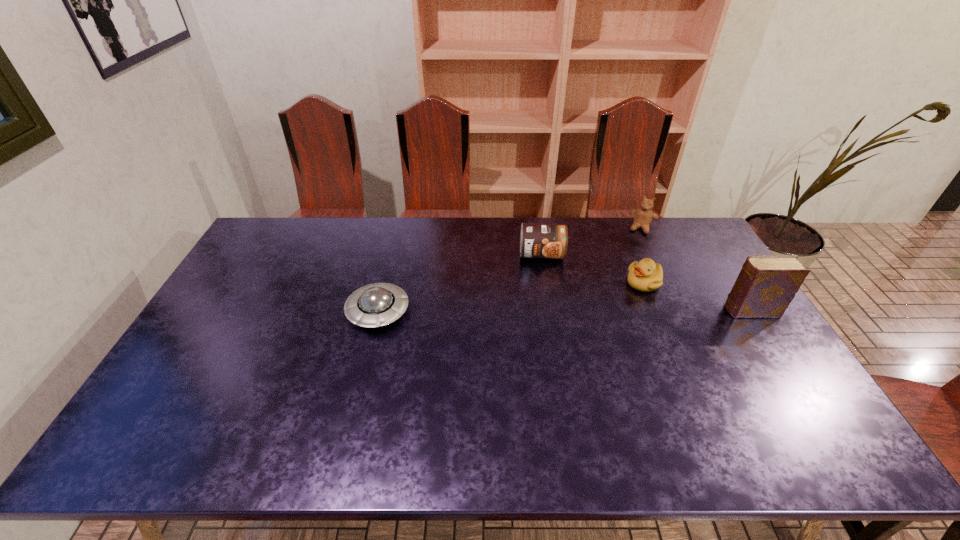
Where is `saucer`? The height and width of the screenshot is (540, 960). saucer is located at coordinates (378, 304).

The width and height of the screenshot is (960, 540). In order to click on the leftmost object in this screenshot , I will do `click(378, 304)`.

The width and height of the screenshot is (960, 540). I want to click on diary, so click(766, 285).

I want to click on the tallest object, so point(766,285).

At what (x,y) coordinates should I click in order to perform the action: click on duckling. Please return your answer as a coordinate pair (x, y). Looking at the image, I should click on (645, 275).

Identify the location of the fourth object from right to left. (537, 240).

At what (x,y) coordinates should I click in order to perform the action: click on can. Please return your answer as a coordinate pair (x, y). This screenshot has height=540, width=960. Looking at the image, I should click on (537, 240).

Locate an element on the screen. The width and height of the screenshot is (960, 540). teddy bear is located at coordinates click(x=643, y=216).

Identify the location of blank space located on the back of the saucer. (398, 230).

Image resolution: width=960 pixels, height=540 pixels. In order to click on vacant point located 0.120m on the spine side of the diary in this screenshot , I will do `click(685, 310)`.